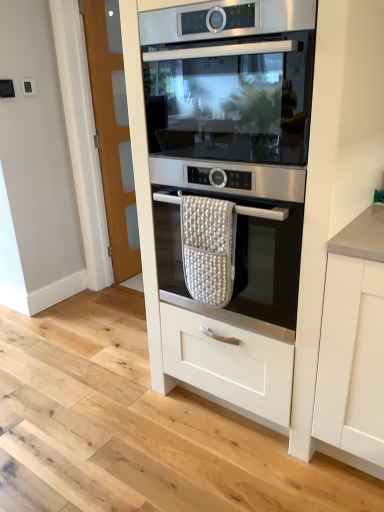
Question: In the image, is satin silver oven at center, marked as the second oven in a top-to-bottom arrangement, positioned in front of or behind white textured oven mitt at center?

Choices:
 (A) behind
 (B) front

Answer: (B)

Question: Is satin silver oven at center, marked as the second oven in a top-to-bottom arrangement, inside the boundaries of white textured oven mitt at center, or outside?

Choices:
 (A) outside
 (B) inside

Answer: (A)

Question: Estimate the real-world distances between objects in this image. Which object is closer to the satin silver oven at center, marked as the second oven in a top-to-bottom arrangement?

Choices:
 (A) stainless steel oven at center, which is counted as the first oven, starting from the top
 (B) white textured oven mitt at center
 (C) stainless steel oven at center

Answer: (B)

Question: Estimate the real-world distances between objects in this image. Which object is farther from the stainless steel oven at center?

Choices:
 (A) white textured oven mitt at center
 (B) satin silver oven at center, the 1th oven from the bottom
 (C) stainless steel oven at center, which is counted as the first oven, starting from the top

Answer: (A)